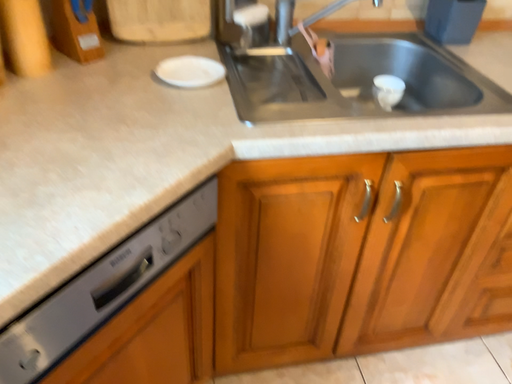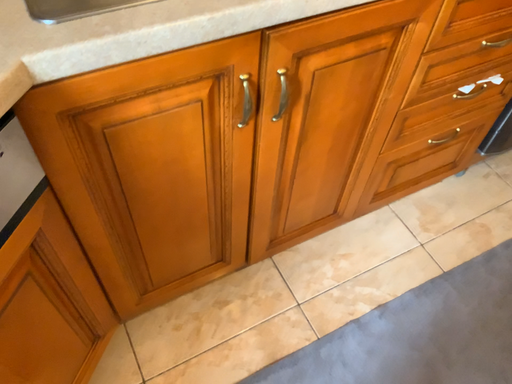
Question: Which way did the camera rotate in the video?

Choices:
 (A) rotated right
 (B) rotated left

Answer: (A)